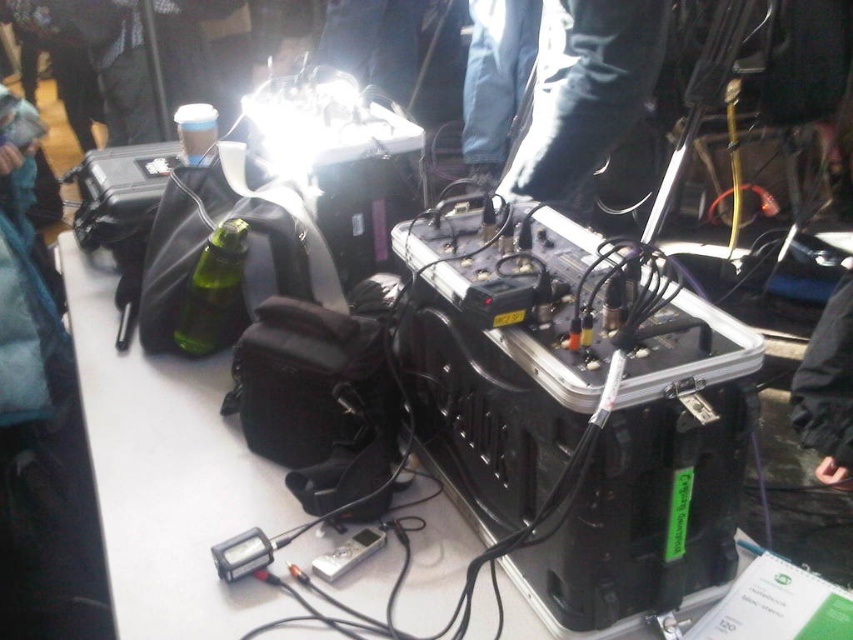
You are standing 5 feet away from the table. You want to pick up the black leather boots at upper center. Can you reach them without moving closer?

The black leather boots at upper center is 3.82 feet away from camera. Since you are standing 5 feet away from the table, you are too far to reach them without moving closer.

You are organizing a small storage closet and need to decide which item to place first between the black leather boots at upper center and the black fabric jacket at lower right. Given their sizes, which one should you place first to optimize space?

The black leather boots at upper center has a larger size compared to the black fabric jacket at lower right, so you should place the black leather boots at upper center first to optimize space.

You are standing at the edge of the table and want to place a small item exactly at the center of the table. Considering the black leather boots at upper center are located at coordinates point 0.142, 0.687, can you determine if this point is the center of the table?

The black leather boots at upper center are located at point [585,90], which does not correspond to the exact center of the table. The center would be at coordinates [426,320], so the boots are positioned to the left and lower than the true center.